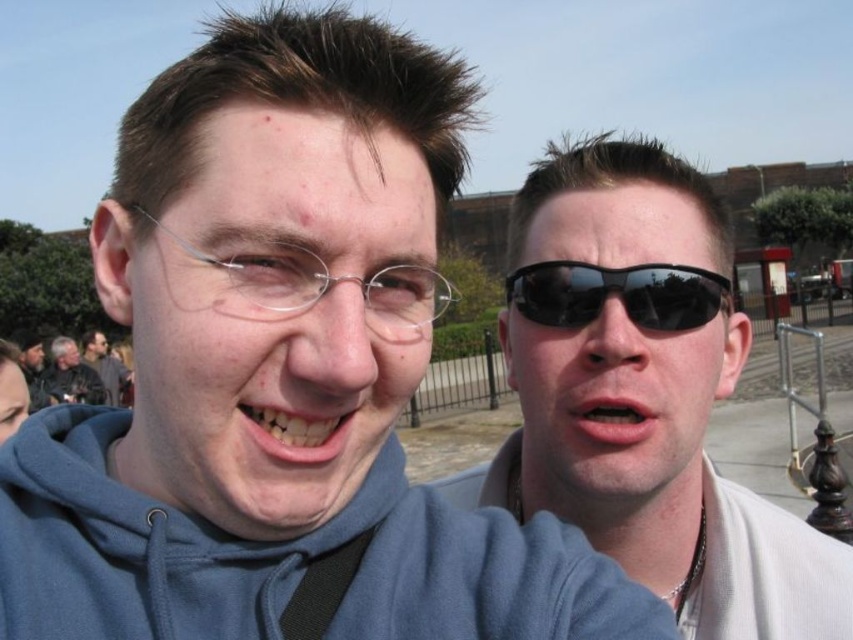
Does black matte sunglasses at right have a lesser width compared to matte gray hoodie at left?

Indeed, black matte sunglasses at right has a lesser width compared to matte gray hoodie at left.

Is black matte sunglasses at right positioned before matte gray hoodie at left?

Yes, it is in front of matte gray hoodie at left.

Does point (657, 428) lie behind point (30, 353)?

That is False.

This screenshot has width=853, height=640. In order to click on black matte sunglasses at right in this screenshot , I will do `click(616, 396)`.

Consider the image. Is black plastic sunglasses at center closer to camera compared to matte black jacket at left?

Yes, black plastic sunglasses at center is closer to the viewer.

Which is behind, point (602, 282) or point (73, 387)?

Positioned behind is point (73, 387).

Is point (656, 269) more distant than point (80, 371)?

No.

The image size is (853, 640). In order to click on black plastic sunglasses at center in this screenshot , I will do `click(618, 292)`.

Is point (186, 465) positioned behind point (32, 390)?

No, (186, 465) is closer to viewer.

The image size is (853, 640). What are the coordinates of `matte plastic glasses at center` in the screenshot? It's located at (276, 316).

This screenshot has width=853, height=640. Identify the location of matte plastic glasses at center. (276, 316).